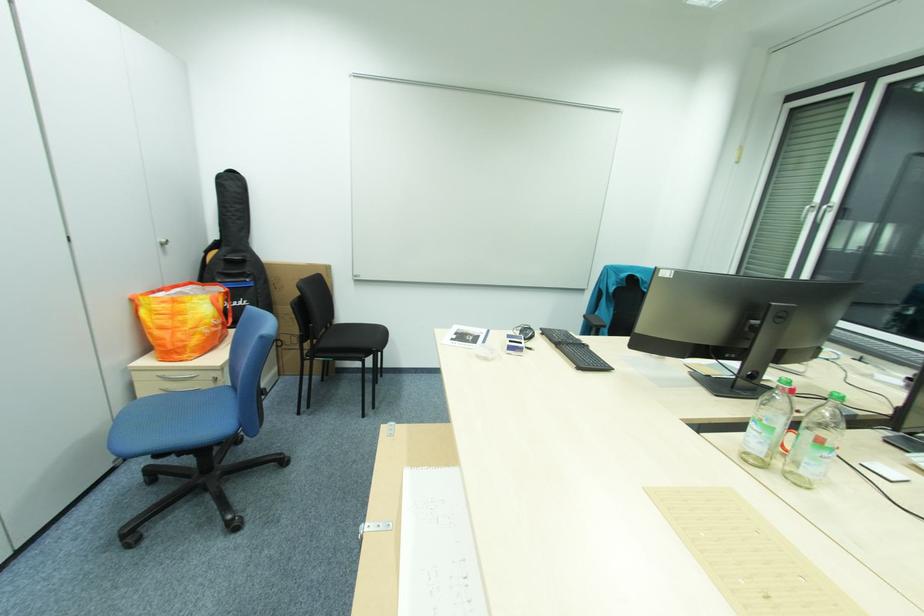
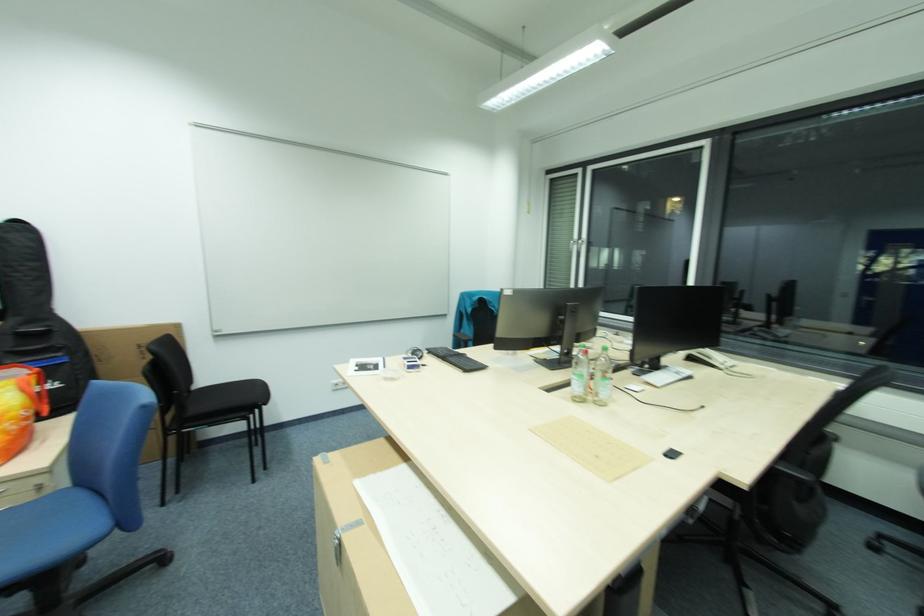
Where in the second image is the point corresponding to point (217, 385) from the first image?

(37, 498)